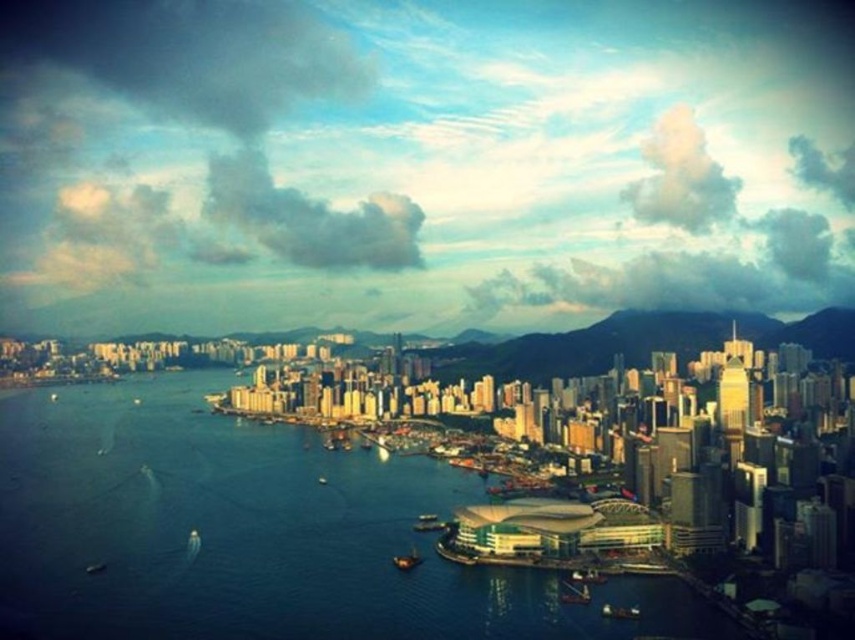
You are an architect designing a new observation deck that needs to have a clear view of both the blue water at center and the metallic gray boat at lower center. Based on the scene, which object will require a higher elevation to ensure it remains visible from the deck?

The blue water at center has a greater height compared to the metallic gray boat at lower center, so the observation deck will need to be elevated enough to see over the blue water at center to ensure visibility of the metallic gray boat at lower center.

You are a photographer planning to capture a wide shot of the city skyline. You notice the blue water at center and the metallic gray boat at lower center. Which object will occupy more space in your photo?

The blue water at center will occupy more space in the photo because it is bigger than the metallic gray boat at lower center.

You are a drone operator trying to capture a photo of the city skyline. Your drone is currently hovering above the blue water at center. To get the best shot, you need to move the drone to the upper right corner of the image. What direction should you move the drone from its current position?

The blue water at center is located at point (258, 532). To move to the upper right corner, you should move the drone upwards and to the right from the blue water at center.